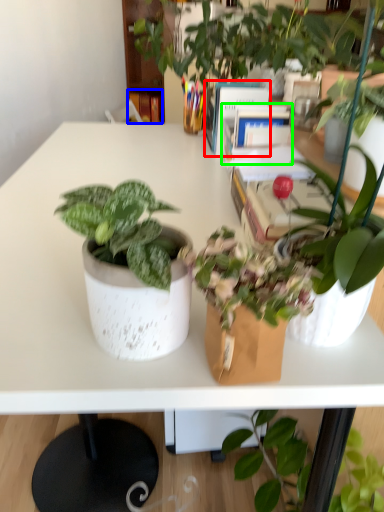
Question: Based on their relative distances, which object is nearer to book (highlighted by a red box)? Choose from book (highlighted by a blue box) and book (highlighted by a green box).

Choices:
 (A) book
 (B) book

Answer: (B)